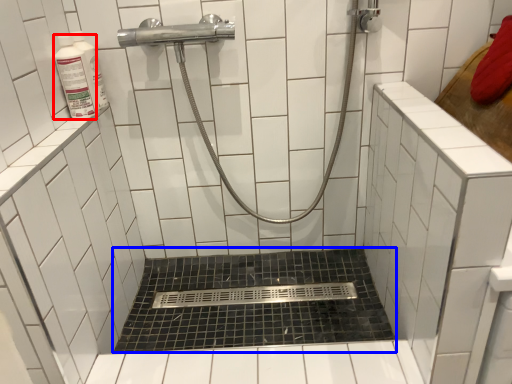
Question: Which point is closer to the camera, toiletry (highlighted by a red box) or bath (highlighted by a blue box)?

Choices:
 (A) toiletry
 (B) bath

Answer: (A)